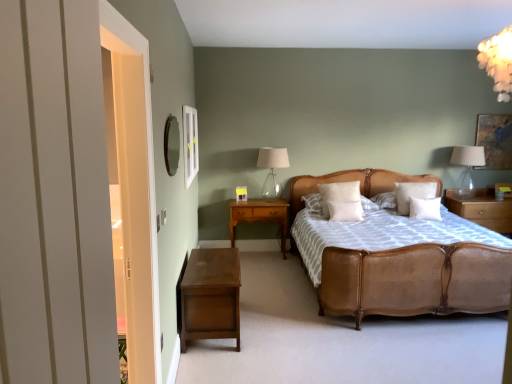
Question: Is white glossy frame at upper left aimed at clear glass table lamp at upper right, the 1th table lamp from the right?

Choices:
 (A) yes
 (B) no

Answer: (A)

Question: Is white glossy frame at upper left shorter than clear glass table lamp at upper right, the 1th table lamp from the right?

Choices:
 (A) yes
 (B) no

Answer: (B)

Question: From the image's perspective, is white glossy frame at upper left beneath clear glass table lamp at upper right, arranged as the 2th table lamp when viewed from the left?

Choices:
 (A) yes
 (B) no

Answer: (B)

Question: Does white glossy frame at upper left appear on the right side of clear glass table lamp at upper right, arranged as the 2th table lamp when viewed from the left?

Choices:
 (A) no
 (B) yes

Answer: (A)

Question: From a real-world perspective, is white glossy frame at upper left located beneath clear glass table lamp at upper right, the 1th table lamp from the right?

Choices:
 (A) no
 (B) yes

Answer: (A)

Question: Does white glossy frame at upper left have a smaller size compared to clear glass table lamp at upper right, the 1th table lamp from the right?

Choices:
 (A) no
 (B) yes

Answer: (B)

Question: Is dark brown wood nightstand at lower left, which is the third nightstand from right to left, to the left of clear glass table lamp at center, arranged as the 2th table lamp when viewed from the right, from the viewer's perspective?

Choices:
 (A) no
 (B) yes

Answer: (B)

Question: Can you confirm if dark brown wood nightstand at lower left, the first nightstand viewed from the front, is smaller than clear glass table lamp at center, the 1th table lamp in the left-to-right sequence?

Choices:
 (A) no
 (B) yes

Answer: (A)

Question: Can you confirm if dark brown wood nightstand at lower left, the first nightstand viewed from the front, is wider than clear glass table lamp at center, arranged as the 2th table lamp when viewed from the right?

Choices:
 (A) no
 (B) yes

Answer: (B)

Question: Is dark brown wood nightstand at lower left, the first nightstand viewed from the front, facing towards clear glass table lamp at center, arranged as the 2th table lamp when viewed from the right?

Choices:
 (A) no
 (B) yes

Answer: (A)

Question: Is dark brown wood nightstand at lower left, the third nightstand in the back-to-front sequence, not within clear glass table lamp at center, arranged as the 2th table lamp when viewed from the right?

Choices:
 (A) no
 (B) yes

Answer: (B)

Question: From the image's perspective, is dark brown wood nightstand at lower left, the first nightstand viewed from the front, beneath clear glass table lamp at center, arranged as the 2th table lamp when viewed from the right?

Choices:
 (A) yes
 (B) no

Answer: (A)

Question: From a real-world perspective, does woven rattan bed at center sit lower than white soft pillow at center, which ranks as the second pillow in left-to-right order?

Choices:
 (A) no
 (B) yes

Answer: (B)